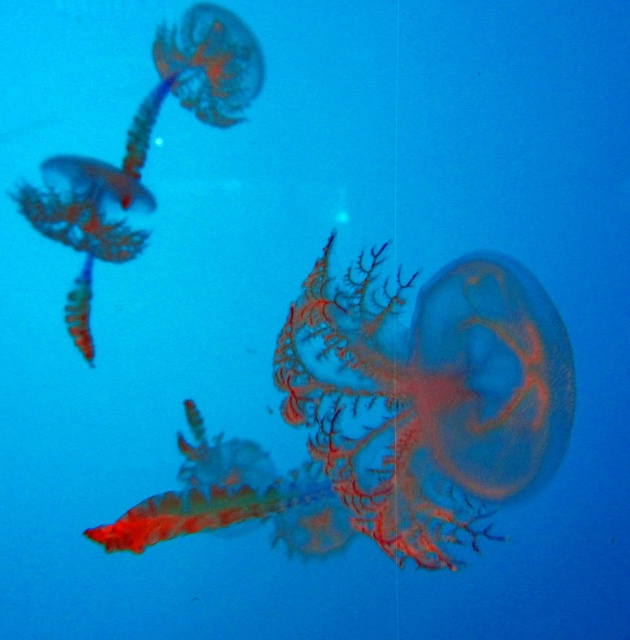
You are a marine biologist observing this underwater scene. You notice two points marked in the image. Which point is closer to you, point 1 at coordinates point (466, 488) or point 2 at coordinates point (127, 145)?

Point 1 at coordinates point (466, 488) is closer to you than point 2 at coordinates point (127, 145).

You are a marine biologist observing the underwater scene. You need to determine which jellyfish has a larger width between the translucent orange jellyfish at center and the translucent gelatinous at left. Based on the available information, which one is wider?

The translucent orange jellyfish at center might be wider than translucent gelatinous at left.